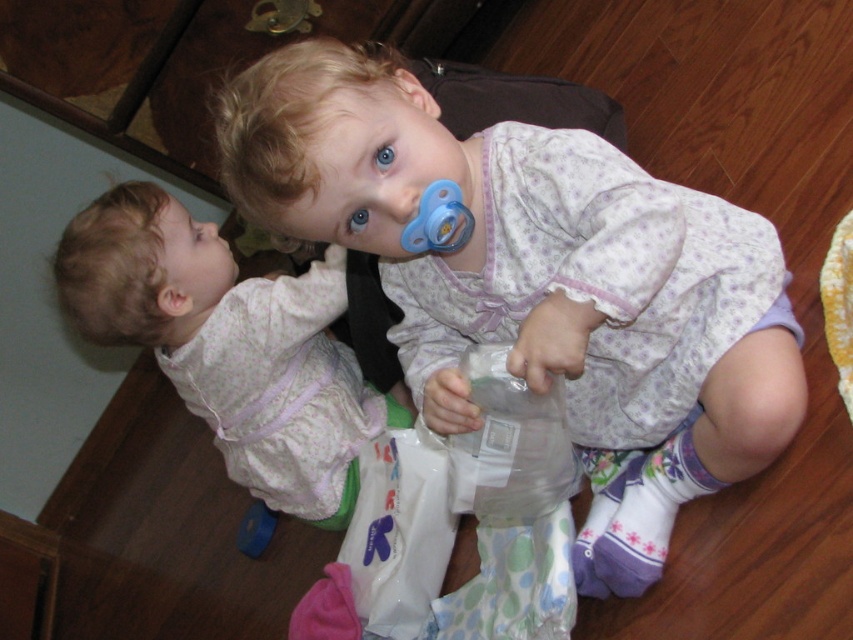
You are a photographer setting up for a family portrait. You notice the white cotton baby at center and the pink fabric diaper at lower left. Which object should you adjust to ensure the baby is the main focus of the shot?

The white cotton baby at center is taller than the pink fabric diaper at lower left, so you should adjust the pink fabric diaper at lower left to avoid it blocking the baby or drawing attention away from the main subject.

From the picture: You are a photographer setting up for a family portrait. You want to ensure both the white cotton baby at center and the transparent plastic bottle at center are clearly visible in the shot. Given their current distance, is the spacing between them sufficient for a standard camera lens to capture both without needing to adjust the focus or zoom?

The white cotton baby at center and transparent plastic bottle at center are 5.64 inches apart from each other. A standard camera lens can easily capture both subjects at this distance without needing to adjust focus or zoom, as the separation allows for adequate depth of field.